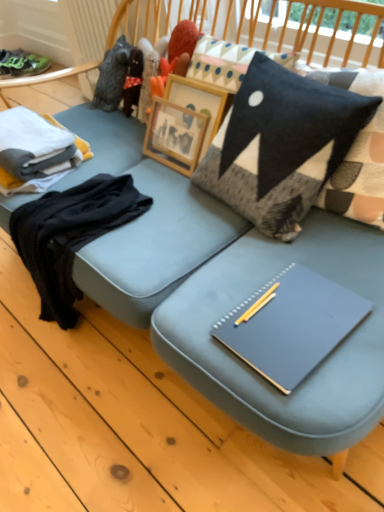
Question: In the image, is black felt pillow at upper right positioned in front of or behind white cotton folded clothes at left, which ranks as the second clothing in bottom-to-top order?

Choices:
 (A) front
 (B) behind

Answer: (A)

Question: Is black felt pillow at upper right situated inside white cotton folded clothes at left, which ranks as the 1th clothing in top-to-bottom order, or outside?

Choices:
 (A) outside
 (B) inside

Answer: (A)

Question: Which object is the farthest from the green suede sneakers at upper left?

Choices:
 (A) white cotton folded clothes at left, which ranks as the 1th clothing in top-to-bottom order
 (B) matte gray notebook at center
 (C) black felt pillow at upper right
 (D) black cotton sweater at left, the first clothing positioned from the bottom

Answer: (B)

Question: Which object is positioned farthest from the black felt pillow at upper right?

Choices:
 (A) matte gray notebook at center
 (B) white cotton folded clothes at left, which ranks as the 1th clothing in top-to-bottom order
 (C) green suede sneakers at upper left
 (D) black cotton sweater at left, which is the 2th clothing from top to bottom

Answer: (C)